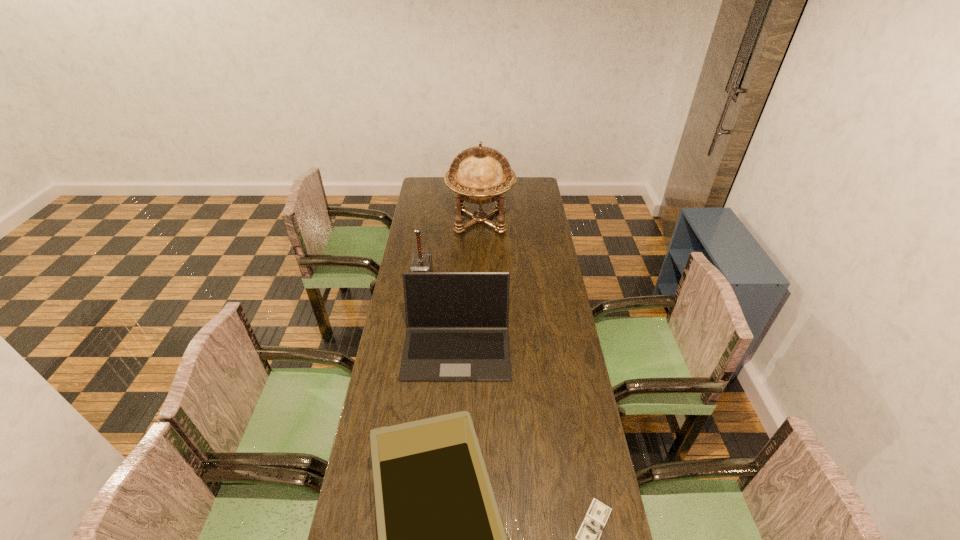
This screenshot has width=960, height=540. What are the coordinates of `vacant space at the left edge` in the screenshot? It's located at (374, 415).

You are a GUI agent. You are given a task and a screenshot of the screen. Output one action in this format:
    pyautogui.click(x=<x>, y=<y>)
    Task: Click on the vacant point at the right edge
    The width and height of the screenshot is (960, 540).
    Given the screenshot: What is the action you would take?
    pyautogui.click(x=530, y=215)

Locate an element on the screen. This screenshot has width=960, height=540. blank region between the second farthest object and the globe is located at coordinates (451, 248).

Select which object is the closest to the hammer. Please provide its 2D coordinates. Your answer should be formatted as a tuple, i.e. [(x, y)], where the tuple contains the x and y coordinates of a point satisfying the conditions above.

[(457, 322)]

Select which object appears as the second closest to the hammer. Please provide its 2D coordinates. Your answer should be formatted as a tuple, i.e. [(x, y)], where the tuple contains the x and y coordinates of a point satisfying the conditions above.

[(480, 175)]